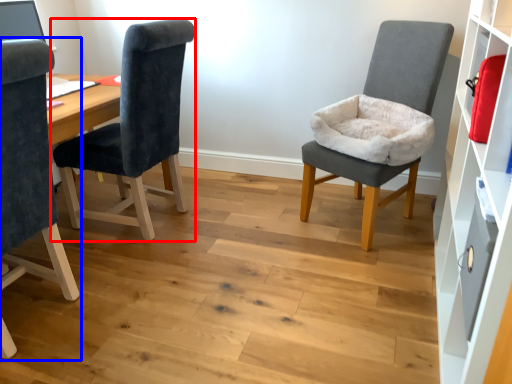
Question: Which object appears closest to the camera in this image, chair (highlighted by a red box) or chair (highlighted by a blue box)?

Choices:
 (A) chair
 (B) chair

Answer: (B)